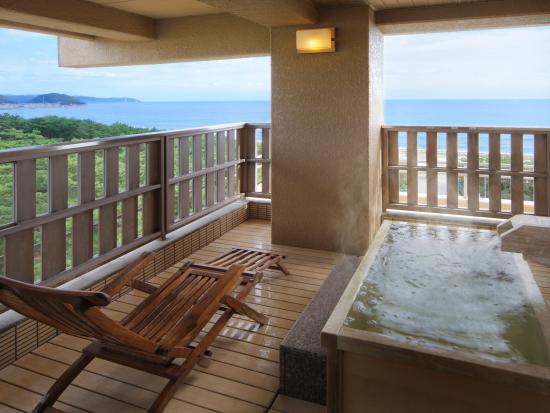
Image resolution: width=550 pixels, height=413 pixels. In order to click on light in this screenshot , I will do `click(320, 31)`.